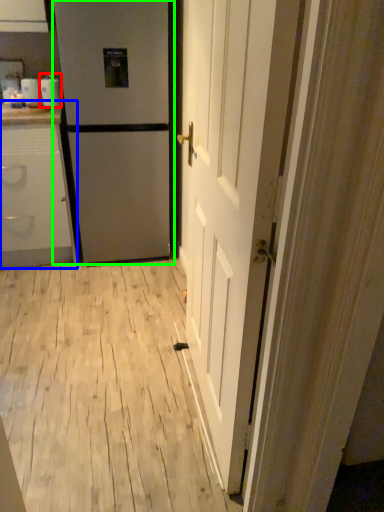
Question: Based on their relative distances, which object is farther from appliance (highlighted by a red box)? Choose from cabinetry (highlighted by a blue box) and refrigerator (highlighted by a green box).

Choices:
 (A) cabinetry
 (B) refrigerator

Answer: (A)